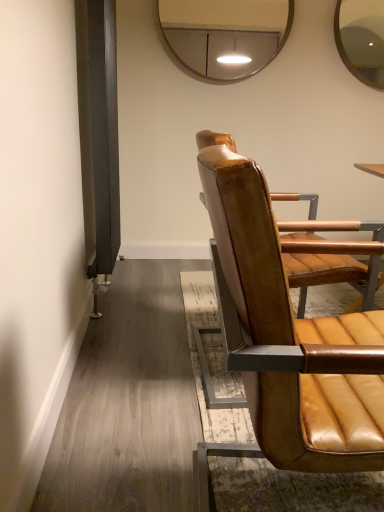
Question: Is leather seat at right taller or shorter than metallic silver mirror at upper center?

Choices:
 (A) tall
 (B) short

Answer: (A)

Question: Considering their positions, is leather seat at right located in front of or behind metallic silver mirror at upper center?

Choices:
 (A) behind
 (B) front

Answer: (B)

Question: Looking at their shapes, would you say leather seat at right is wider or thinner than metallic silver mirror at upper center?

Choices:
 (A) wide
 (B) thin

Answer: (A)

Question: In the image, is metallic silver mirror at upper center on the left side or the right side of leather seat at right?

Choices:
 (A) left
 (B) right

Answer: (A)

Question: Choose the correct answer: Is metallic silver mirror at upper center inside leather seat at right or outside it?

Choices:
 (A) outside
 (B) inside

Answer: (A)

Question: From their relative heights in the image, would you say metallic silver mirror at upper center is taller or shorter than leather seat at right?

Choices:
 (A) short
 (B) tall

Answer: (A)

Question: Considering the positions of metallic silver mirror at upper center and leather seat at right in the image, is metallic silver mirror at upper center bigger or smaller than leather seat at right?

Choices:
 (A) big
 (B) small

Answer: (B)